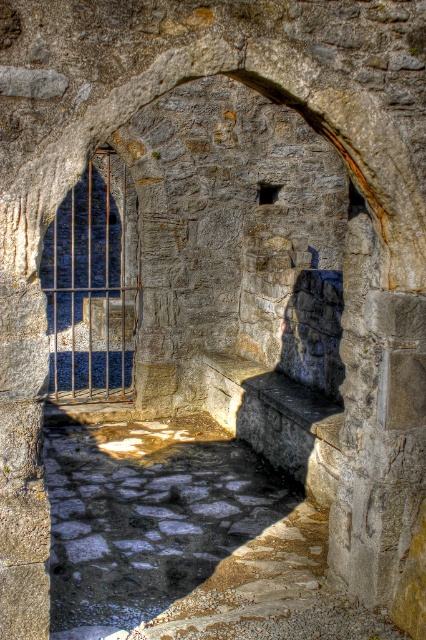
Measure the distance from stone cobblestone pathway at center to rusty metal gate at center.

A distance of 3.92 meters exists between stone cobblestone pathway at center and rusty metal gate at center.

Can you confirm if stone cobblestone pathway at center is smaller than rusty metal gate at center?

No.

What are the coordinates of `stone cobblestone pathway at center` in the screenshot? It's located at (187, 540).